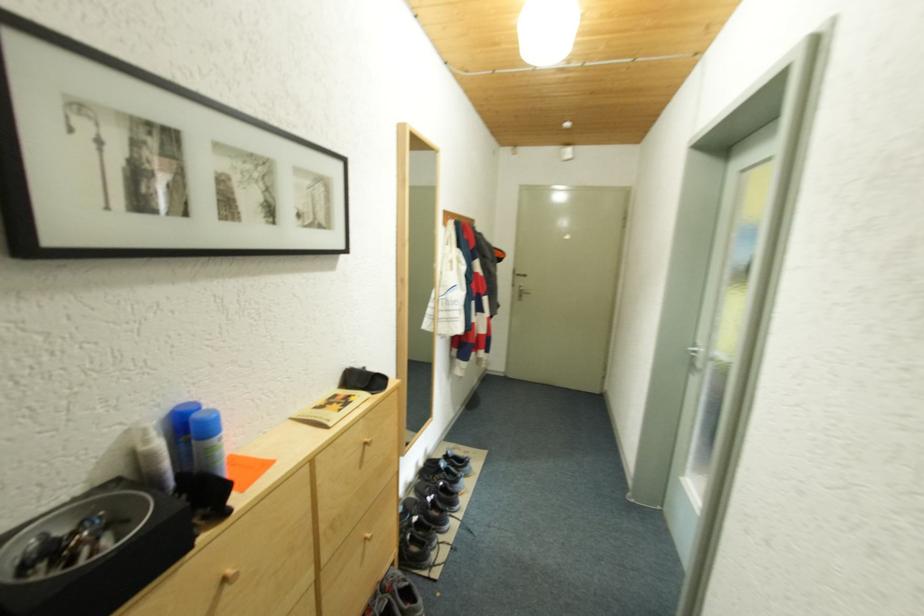
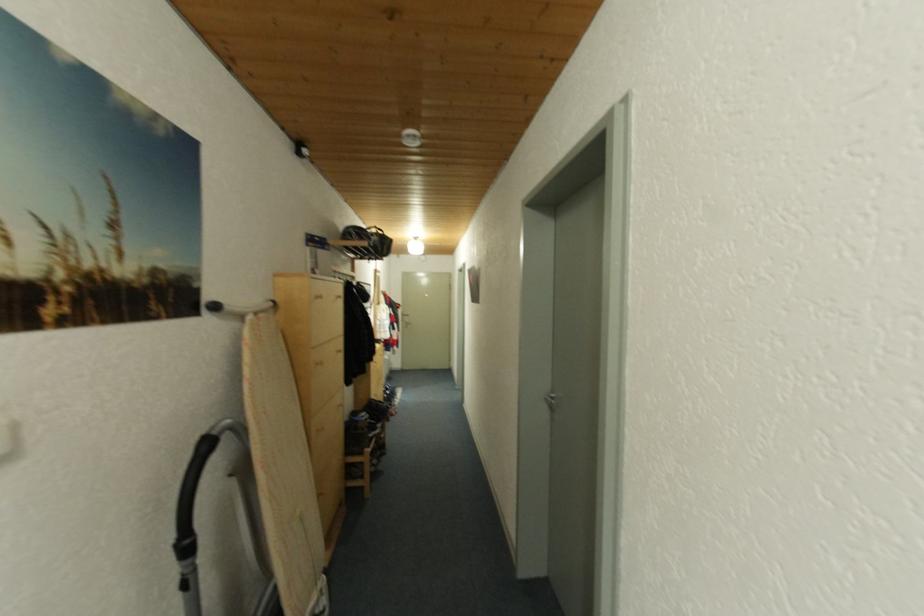
Question: What movement of the cameraman would produce the second image?

Choices:
 (A) Left
 (B) Right
 (C) Forward
 (D) Backward

Answer: (D)